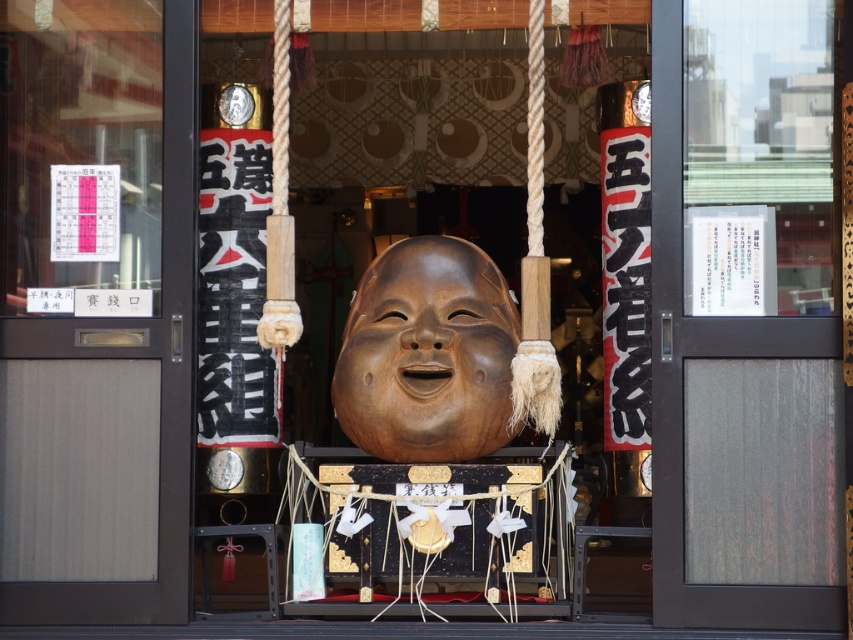
Measure the distance from wooden statue at center to wooden mask at center.

wooden statue at center is 2.46 meters from wooden mask at center.

Does point (373, 300) come closer to viewer compared to point (415, 301)?

No, it is behind (415, 301).

This screenshot has width=853, height=640. I want to click on wooden statue at center, so click(428, 428).

Who is more distant from viewer, (x=463, y=349) or (x=653, y=314)?

The point (x=463, y=349) is more distant.

Identify the location of wooden mask at center. (427, 355).

The height and width of the screenshot is (640, 853). Find the location of `wooden mask at center`. wooden mask at center is located at coordinates (427, 355).

Is wooden statue at center positioned before transparent glass door at center?

That is False.

Does wooden statue at center appear on the right side of transparent glass door at center?

Incorrect, wooden statue at center is not on the right side of transparent glass door at center.

Image resolution: width=853 pixels, height=640 pixels. What are the coordinates of `wooden statue at center` in the screenshot? It's located at (428, 428).

Where is `wooden statue at center`? This screenshot has width=853, height=640. wooden statue at center is located at coordinates (428, 428).